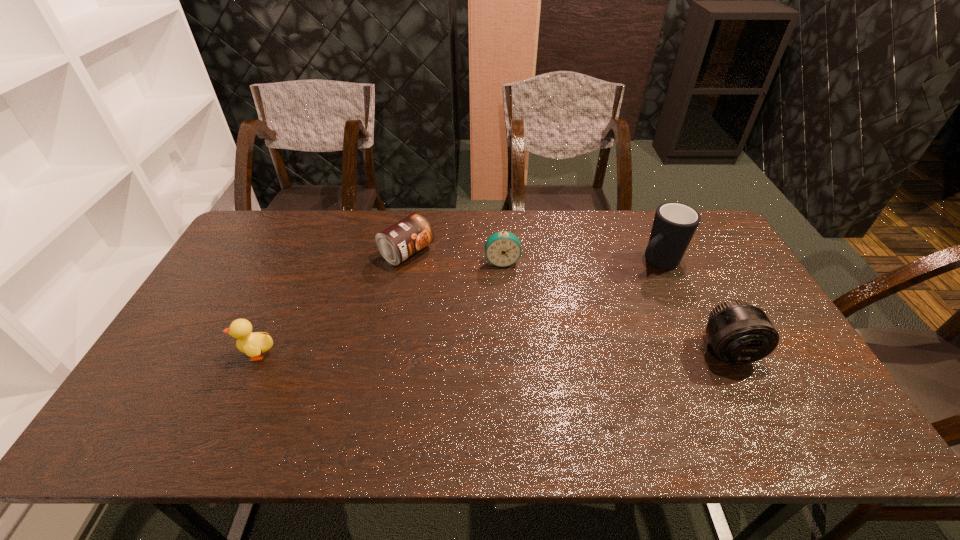
The width and height of the screenshot is (960, 540). I want to click on vacant point located on the side of the tallest object with the handle, so click(568, 323).

What are the coordinates of `free space located 0.100m on the side of the tallest object with the handle` in the screenshot? It's located at point(622,285).

You are a GUI agent. You are given a task and a screenshot of the screen. Output one action in this format:
    pyautogui.click(x=<x>, y=<y>)
    Task: Click on the free spot located on the side of the tallest object with the handle
    This screenshot has height=540, width=960.
    Given the screenshot: What is the action you would take?
    pyautogui.click(x=561, y=328)

Find the location of a particular element. This screenshot has height=540, width=960. vacant area located on the front label of the fourth object from right to left is located at coordinates (506, 316).

Where is `vacant point located 0.310m on the front label of the fourth object from right to left`? vacant point located 0.310m on the front label of the fourth object from right to left is located at coordinates (501, 312).

Locate an element on the screen. This screenshot has width=960, height=540. vacant space situated on the front label of the fourth object from right to left is located at coordinates (453, 282).

Where is `mug present at the far edge`? The width and height of the screenshot is (960, 540). mug present at the far edge is located at coordinates (674, 225).

I want to click on can at the far edge, so click(x=408, y=236).

Where is `object that is at the right edge`? The width and height of the screenshot is (960, 540). object that is at the right edge is located at coordinates (739, 333).

In the image, there is a desktop. At what (x,y) coordinates should I click in order to perform the action: click on free region at the far edge. Please return your answer as a coordinate pair (x, y). Image resolution: width=960 pixels, height=540 pixels. Looking at the image, I should click on (574, 238).